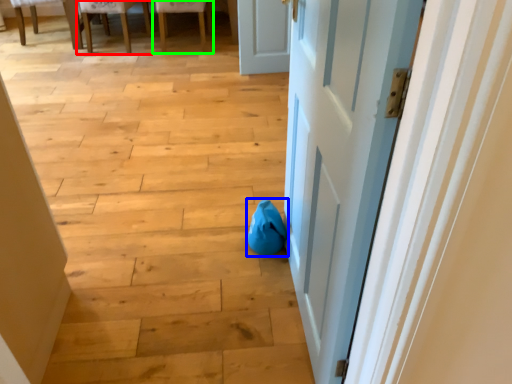
Question: Estimate the real-world distances between objects in this image. Which object is farther from chair (highlighted by a red box), bean bag chair (highlighted by a blue box) or chair (highlighted by a green box)?

Choices:
 (A) bean bag chair
 (B) chair

Answer: (A)